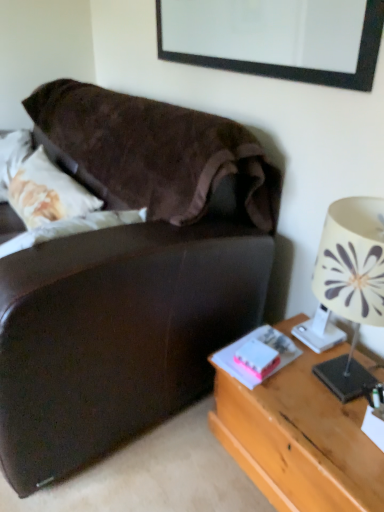
This screenshot has height=512, width=384. In order to click on vacant space situated above wooden desk at right (from a real-world perspective) in this screenshot , I will do `click(322, 399)`.